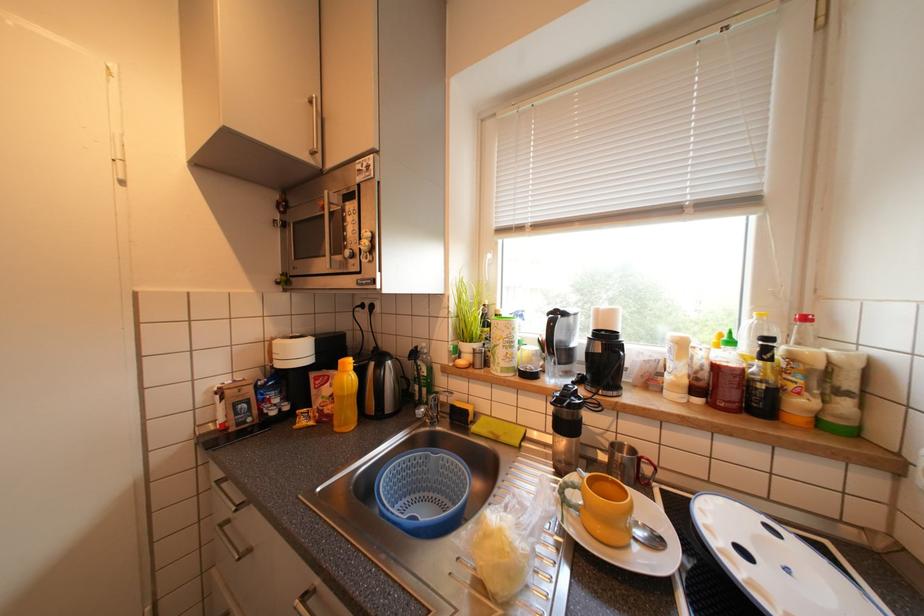
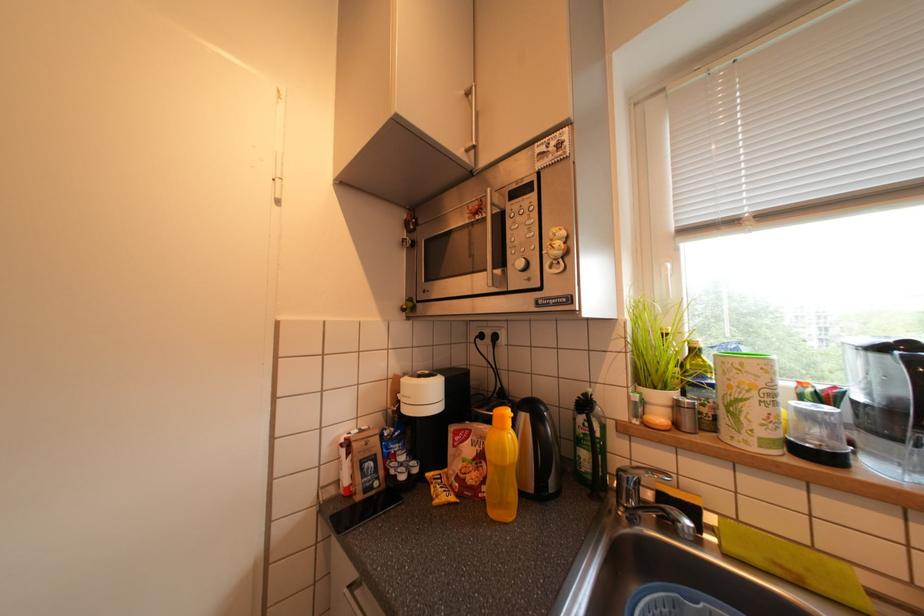
Question: The images are taken continuously from a first-person perspective. In which direction is your viewpoint rotating?

Choices:
 (A) Left
 (B) Right
 (C) Up
 (D) Down

Answer: (A)